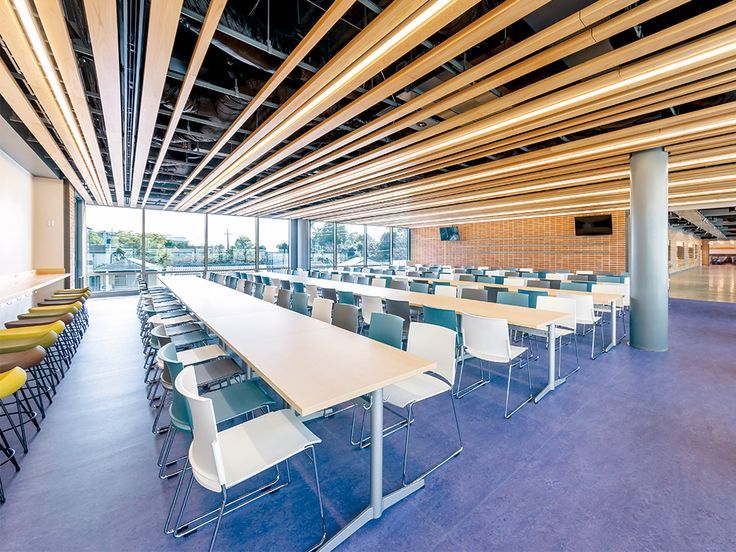
Find the location of a particular element. window is located at coordinates (116, 251), (160, 246), (232, 236), (276, 237), (322, 237), (347, 240), (372, 240), (397, 236).